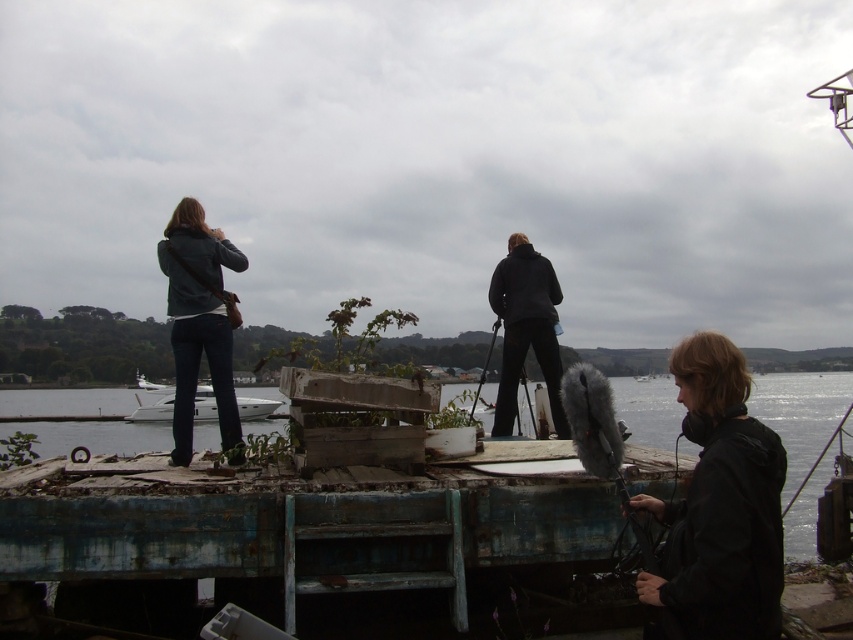
Who is more forward, (18,397) or (538,262)?

Point (538,262) is more forward.

Measure the distance between rusty metal water at lower center and black matte jacket at center.

The distance of rusty metal water at lower center from black matte jacket at center is 10.12 meters.

What do you see at coordinates (799, 413) in the screenshot? The width and height of the screenshot is (853, 640). I see `rusty metal water at lower center` at bounding box center [799, 413].

Where is `rusty metal water at lower center`? This screenshot has height=640, width=853. rusty metal water at lower center is located at coordinates (799, 413).

Between rusty metal water at lower center and white glossy boat at center, which one appears on the left side from the viewer's perspective?

From the viewer's perspective, white glossy boat at center appears more on the left side.

Who is taller, rusty metal water at lower center or white glossy boat at center?

rusty metal water at lower center

What do you see at coordinates (799, 413) in the screenshot? I see `rusty metal water at lower center` at bounding box center [799, 413].

You are a GUI agent. You are given a task and a screenshot of the screen. Output one action in this format:
    pyautogui.click(x=<x>, y=<y>)
    Task: Click on the rusty metal water at lower center
    
    Given the screenshot: What is the action you would take?
    pyautogui.click(x=799, y=413)

Does point (711, 496) come behind point (473, 401)?

No.

Does black matte jacket at lower right appear over metallic silver fishing pole at center?

Indeed, black matte jacket at lower right is positioned over metallic silver fishing pole at center.

What do you see at coordinates (718, 508) in the screenshot?
I see `black matte jacket at lower right` at bounding box center [718, 508].

The height and width of the screenshot is (640, 853). What are the coordinates of `black matte jacket at lower right` in the screenshot? It's located at (718, 508).